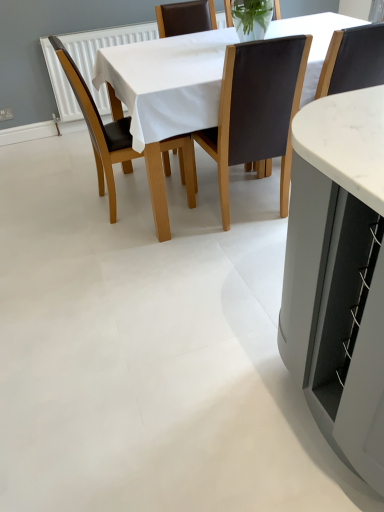
I want to click on free space in front of brown leather chair at center, acting as the second chair starting from the right, so click(x=246, y=253).